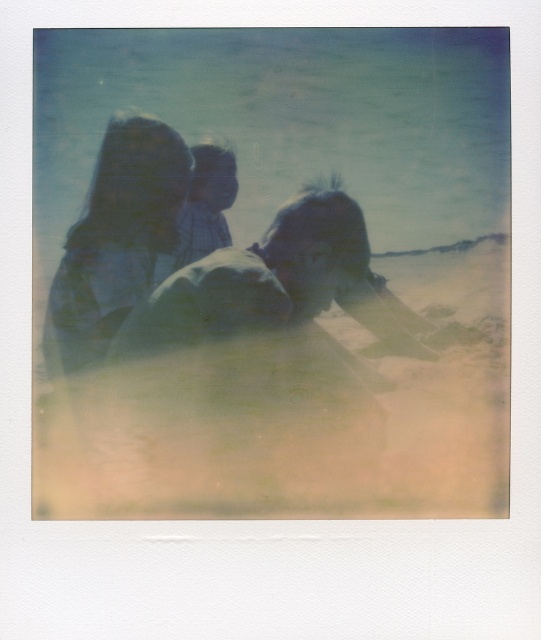
Question: Is blue fabric couple at center above translucent blue hair at upper left?

Choices:
 (A) no
 (B) yes

Answer: (A)

Question: Which point is farther to the camera?

Choices:
 (A) translucent blue hair at upper left
 (B) blue fabric couple at center
 (C) plaid fabric shirt at center

Answer: (C)

Question: Considering the relative positions of blue fabric couple at center and translucent blue hair at upper left in the image provided, where is blue fabric couple at center located with respect to translucent blue hair at upper left?

Choices:
 (A) above
 (B) below

Answer: (B)

Question: Which point appears farthest from the camera in this image?

Choices:
 (A) (156, 253)
 (B) (45, 323)
 (C) (228, 177)

Answer: (A)

Question: Which point is closer to the camera?

Choices:
 (A) translucent blue hair at upper left
 (B) plaid fabric shirt at center

Answer: (A)

Question: From the image, what is the correct spatial relationship of translucent blue hair at upper left in relation to plaid fabric shirt at center?

Choices:
 (A) right
 (B) left

Answer: (B)